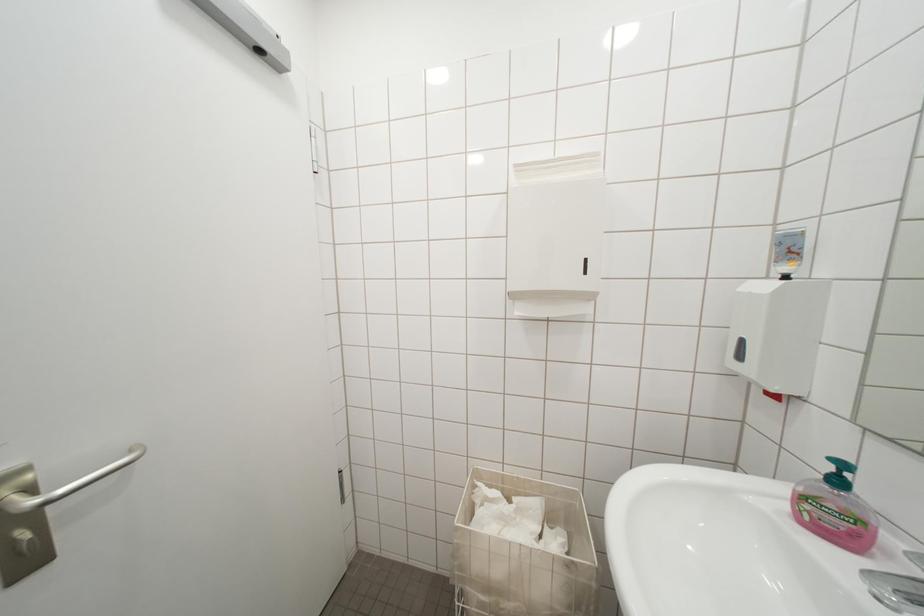
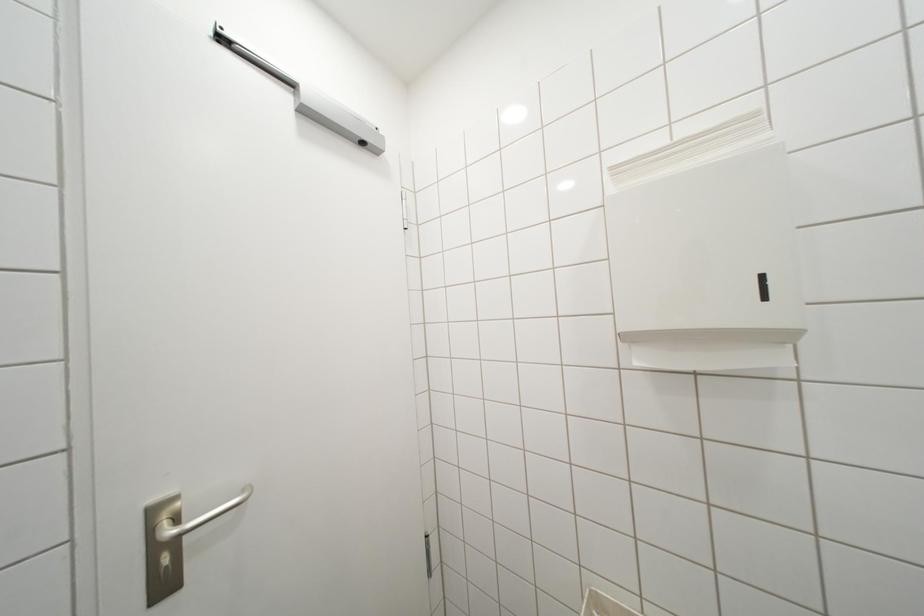
Question: The images are taken continuously from a first-person perspective. In which direction are you moving?

Choices:
 (A) Left
 (B) Right
 (C) Forward
 (D) Backward

Answer: (C)